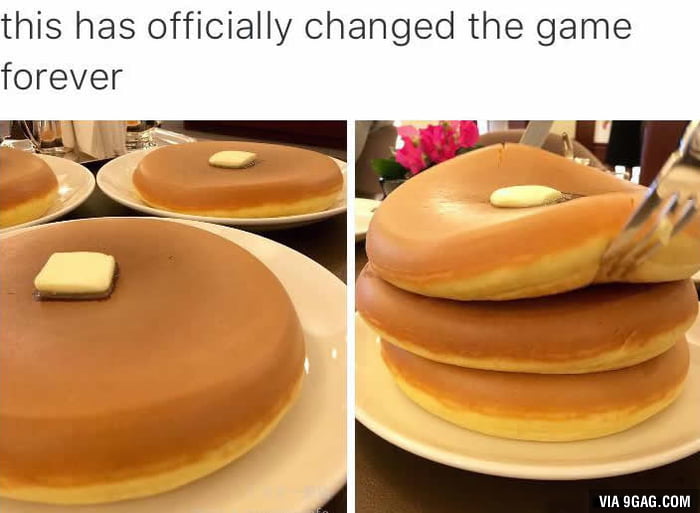
Locate an element on the screen. plate is located at coordinates (300, 484).